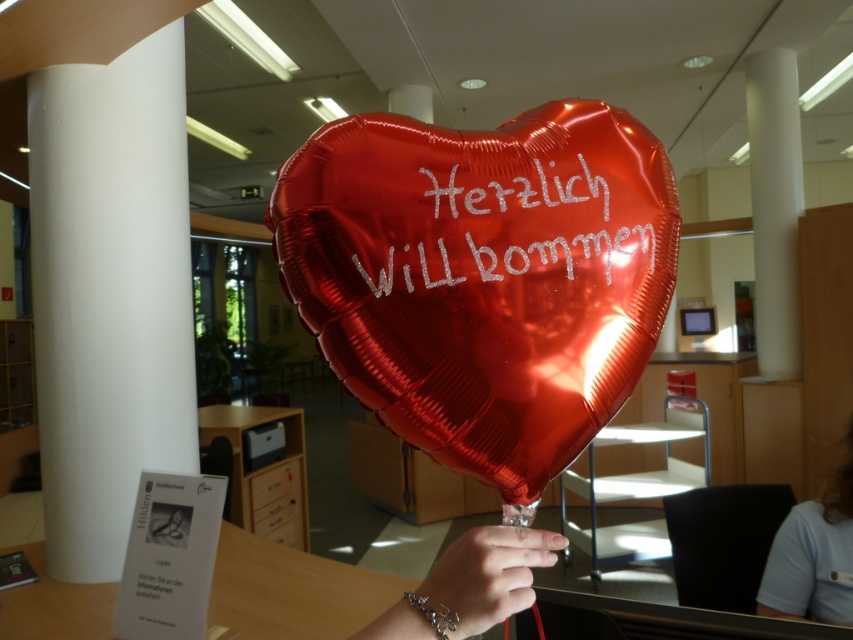
You are standing in the library and want to place a new poster on the wall. The poster needs to be placed between the two points marked as point (767, 260) and point (477, 570). Which point should you place the poster closer to so it is in the middle between them?

To place the poster in the middle between point (767, 260) and point (477, 570), you should position it closer to point (477, 570) because point (767, 260) is behind it, so the midpoint would be closer to the front point.

You are standing in the library scene and want to place a new decorative item between the white smooth pillar at right and the metallic silver bracelet at lower center. Based on their current positions, which object should you place it closer to in order to center it between them?

The white smooth pillar at right is positioned on the right side of metallic silver bracelet at lower center. To center the new decorative item between them, place it closer to the metallic silver bracelet at lower center since the pillar is to its right, creating space to the left.

You are holding a camera and want to take a photo of the shiny metallic heart at center. If the camera requires a minimum distance of 50 centimeters to focus properly, will you be able to take a clear photo?

The shiny metallic heart at center and camera are 52.33 centimeters apart from each other, which is more than the required 50 centimeters. Therefore, you can take a clear photo.